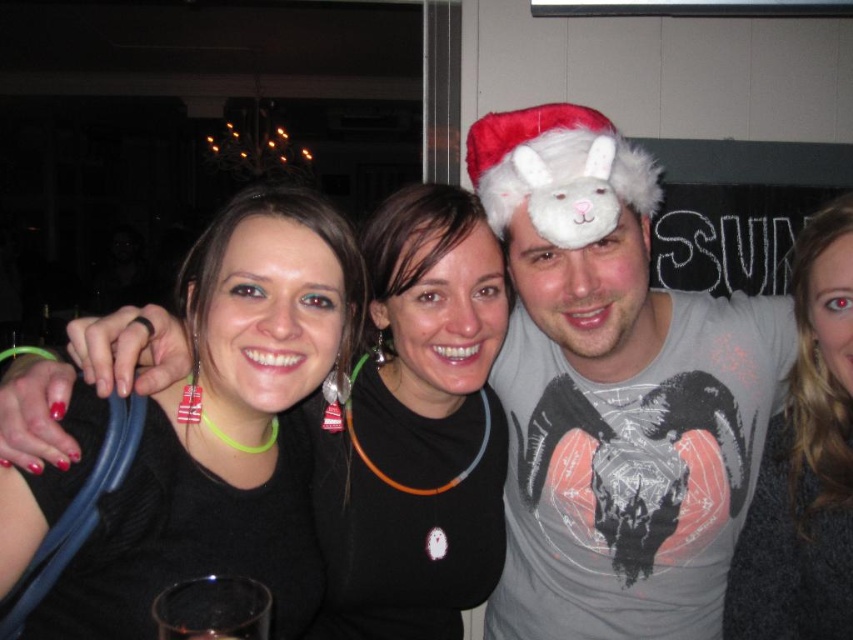
Question: Which point is closer to the camera taking this photo?

Choices:
 (A) (573, 173)
 (B) (418, 616)

Answer: (A)

Question: Is black fabric at center wider than fuzzy white hat at center?

Choices:
 (A) no
 (B) yes

Answer: (B)

Question: Which of the following is the closest to the observer?

Choices:
 (A) gray matte t-shirt at center
 (B) fuzzy white hat at center

Answer: (B)

Question: Does black fabric at center have a smaller size compared to gray fuzzy sweater at upper right?

Choices:
 (A) no
 (B) yes

Answer: (A)

Question: Is gray matte t-shirt at center thinner than fuzzy white hat at center?

Choices:
 (A) no
 (B) yes

Answer: (A)

Question: Which point is closer to the camera?

Choices:
 (A) black fabric at center
 (B) fuzzy white hat at center
 (C) gray matte t-shirt at center

Answer: (B)